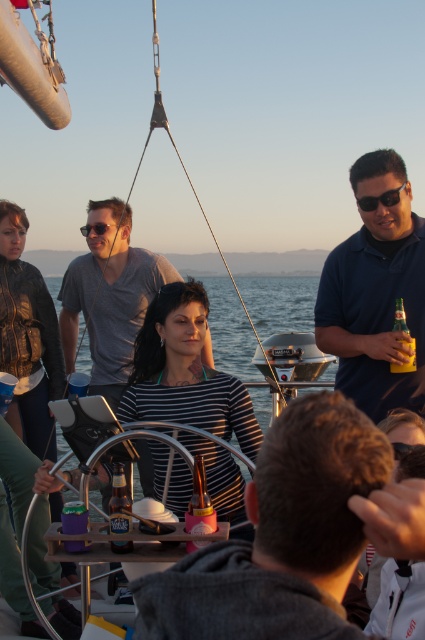
Question: Based on their relative distances, which object is nearer to the black plastic sunglasses at right?

Choices:
 (A) dark blue shirt at right
 (B) yellow matte bottle at right

Answer: (A)

Question: Is matte black shirt at center bigger than metallic silver can at center?

Choices:
 (A) no
 (B) yes

Answer: (B)

Question: Where is matte gray shirt at center located in relation to translucent glass bottle at center in the image?

Choices:
 (A) below
 (B) above

Answer: (B)

Question: Estimate the real-world distances between objects in this image. Which object is closer to the metallic silver can at center?

Choices:
 (A) matte black sunglasses at upper left
 (B) matte black shirt at center
 (C) black plastic sunglasses at right

Answer: (B)

Question: Can you confirm if matte black shirt at center is smaller than dark blue shirt at right?

Choices:
 (A) no
 (B) yes

Answer: (B)

Question: Estimate the real-world distances between objects in this image. Which object is farther from the matte black shirt at center?

Choices:
 (A) matte black sunglasses at upper left
 (B) translucent glass bottle at center

Answer: (A)